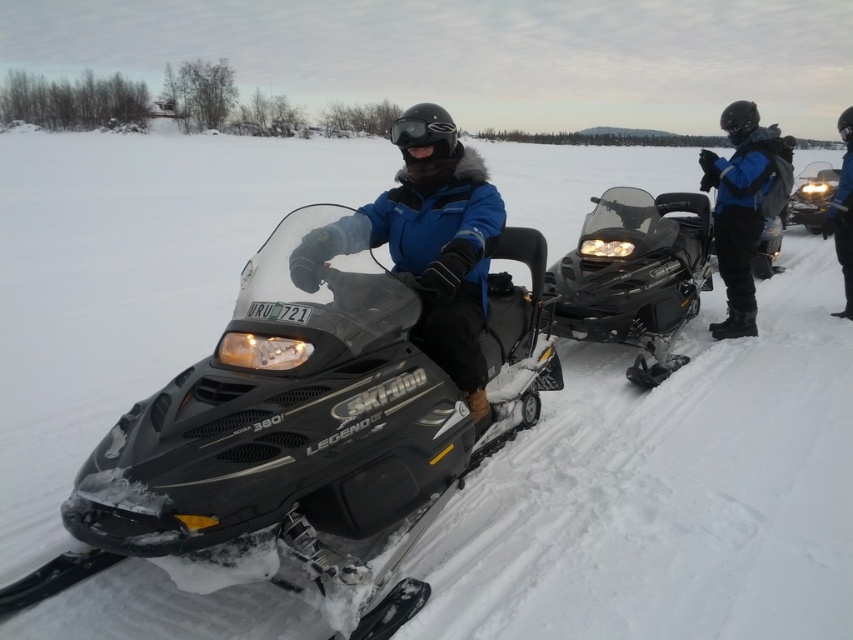
Question: Which point appears farthest from the camera in this image?

Choices:
 (A) (428, 284)
 (B) (260, 390)

Answer: (A)

Question: Does matte blue jacket at center appear over blue matte jacket at center?

Choices:
 (A) no
 (B) yes

Answer: (A)

Question: Can you confirm if blue matte jacket at center is positioned to the right of blue fabric jacket at upper center?

Choices:
 (A) no
 (B) yes

Answer: (A)

Question: Does matte blue jacket at center appear under matte black snowmobile at right?

Choices:
 (A) yes
 (B) no

Answer: (A)

Question: Among these objects, which one is nearest to the camera?

Choices:
 (A) matte blue jacket at center
 (B) blue fabric jacket at upper center

Answer: (A)

Question: Which of the following is the closest to the observer?

Choices:
 (A) blue matte jacket at center
 (B) matte blue jacket at center
 (C) matte black snowmobile at center
 (D) matte black snowmobile at right

Answer: (C)